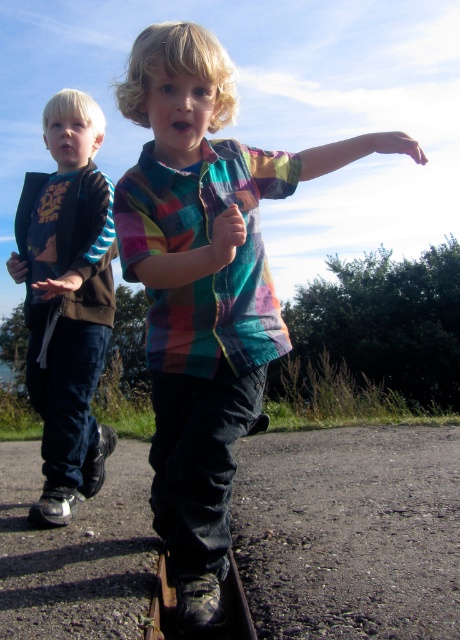
At what (x,y) coordinates should I click in order to perform the action: click on matte black jacket at left. Please return your answer as a coordinate pair (x, y). The image size is (460, 640). Looking at the image, I should click on (67, 301).

Between point (93, 262) and point (225, 228), which one is positioned behind?

The point (93, 262) is behind.

Between point (65, 164) and point (235, 211), which one is positioned behind?

The point (65, 164) is more distant.

The image size is (460, 640). Identify the location of matte black jacket at left. (67, 301).

Is multicolored plaid shirt at center taller than matte black jacket at left?

No.

Is multicolored plaid shirt at center smaller than matte black jacket at left?

Incorrect, multicolored plaid shirt at center is not smaller in size than matte black jacket at left.

Is point (162, 152) positioned behind point (56, 113)?

No, (162, 152) is closer to viewer.

Where is `multicolored plaid shirt at center`? This screenshot has height=640, width=460. multicolored plaid shirt at center is located at coordinates (205, 289).

Measure the distance between point (203, 314) and camera.

Point (203, 314) is 6.79 feet away from camera.

In the scene shown: Is multicolored plaid shirt at center positioned at the back of multicolored fabric arm at center?

No, it is not.

You are a GUI agent. You are given a task and a screenshot of the screen. Output one action in this format:
    pyautogui.click(x=<x>, y=<y>)
    Task: Click on the multicolored plaid shirt at center
    The width and height of the screenshot is (460, 640).
    Given the screenshot: What is the action you would take?
    pyautogui.click(x=205, y=289)

Locate an element on the screen. multicolored plaid shirt at center is located at coordinates [205, 289].